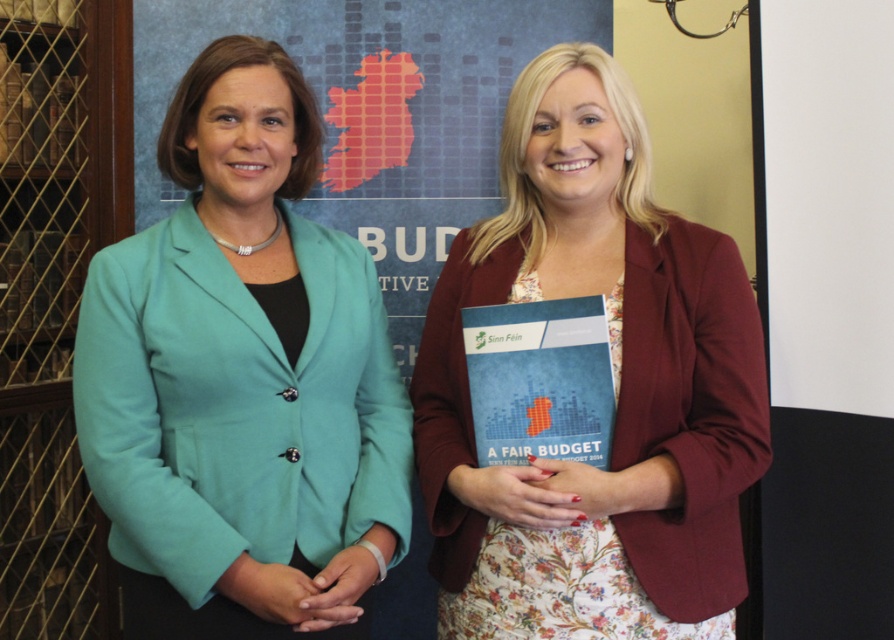
Is maroon textured blazer at center wider than blue paper book at center?

Correct, the width of maroon textured blazer at center exceeds that of blue paper book at center.

Between point (530, 608) and point (503, 330), which one is positioned in front?

Positioned in front is point (530, 608).

Between point (493, 499) and point (574, 408), which one is positioned in front?

Positioned in front is point (493, 499).

This screenshot has width=894, height=640. Find the location of `maroon textured blazer at center`. maroon textured blazer at center is located at coordinates (614, 387).

Image resolution: width=894 pixels, height=640 pixels. What do you see at coordinates (242, 380) in the screenshot?
I see `teal fabric jacket at center` at bounding box center [242, 380].

How distant is teal fabric jacket at center from maroon textured blazer at center?

teal fabric jacket at center is 13.18 inches away from maroon textured blazer at center.

This screenshot has height=640, width=894. What do you see at coordinates (242, 380) in the screenshot?
I see `teal fabric jacket at center` at bounding box center [242, 380].

You are a GUI agent. You are given a task and a screenshot of the screen. Output one action in this format:
    pyautogui.click(x=<x>, y=<y>)
    Task: Click on the teal fabric jacket at center
    Image resolution: width=894 pixels, height=640 pixels.
    Given the screenshot: What is the action you would take?
    pyautogui.click(x=242, y=380)

Does teal fabric jacket at center have a lesser height compared to blue paper book at center?

In fact, teal fabric jacket at center may be taller than blue paper book at center.

Is teal fabric jacket at center above blue paper book at center?

Indeed, teal fabric jacket at center is positioned over blue paper book at center.

Between point (267, 445) and point (530, 310), which one is positioned in front?

Point (267, 445) is more forward.

What are the coordinates of `teal fabric jacket at center` in the screenshot? It's located at (242, 380).